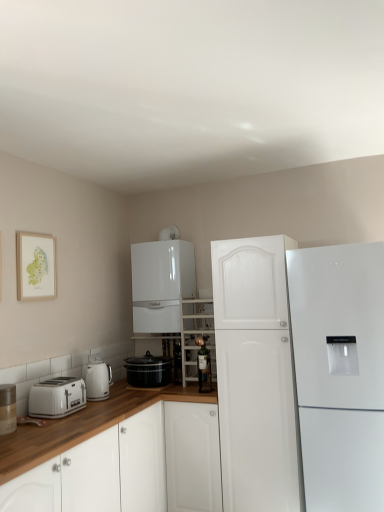
Question: From a real-world perspective, is matte silver canister at left physically located above or below white matte cabinet at center, acting as the 1th refrigerator starting from the right?

Choices:
 (A) below
 (B) above

Answer: (B)

Question: In terms of height, does matte silver canister at left look taller or shorter compared to white matte cabinet at center, the second refrigerator when ordered from left to right?

Choices:
 (A) tall
 (B) short

Answer: (B)

Question: Based on their relative distances, which object is farther from the wooden framed map at upper left?

Choices:
 (A) matte silver canister at left
 (B) white matte cabinet at center, acting as the 1th refrigerator starting from the right
 (C) black glossy slow cooker at lower center, which is the 2th kitchen appliance from left to right
 (D) clear glass shelves at center
 (E) white glossy refrigerator at upper center, acting as the 2th refrigerator starting from the right

Answer: (B)

Question: Which of these objects is positioned closest to the white glossy refrigerator at upper center, the 1th refrigerator positioned from the left?

Choices:
 (A) matte silver canister at left
 (B) matte glass bottle at center
 (C) white plastic toaster at lower left
 (D) black glossy slow cooker at lower center, marked as the first kitchen appliance in a right-to-left arrangement
 (E) white glossy cabinet at lower left

Answer: (D)